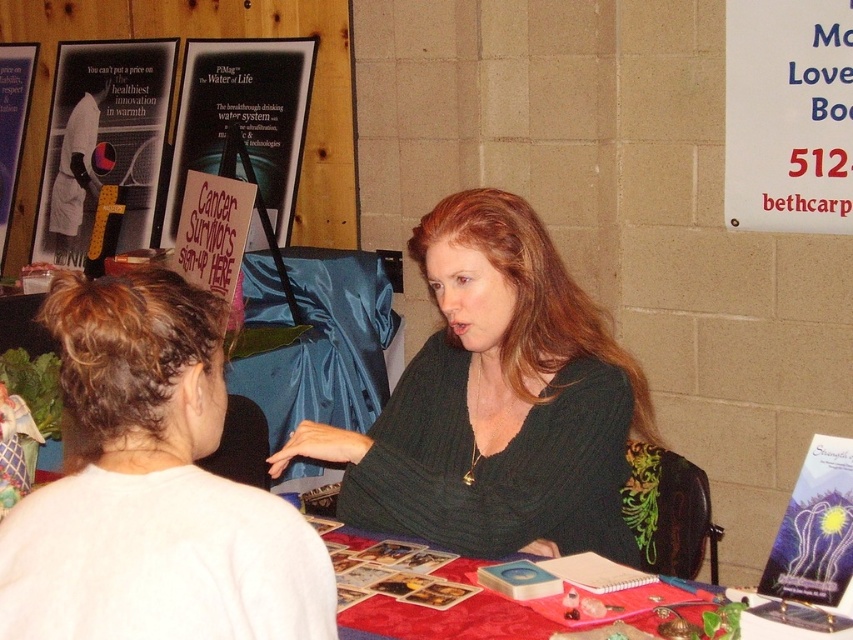
Question: Among these objects, which one is nearest to the camera?

Choices:
 (A) green knitted sweater at center
 (B) white paper sign at upper left

Answer: (A)

Question: Does white paper sign at upper right have a smaller size compared to matte black tennis racket at upper left?

Choices:
 (A) no
 (B) yes

Answer: (B)

Question: Does white paper sign at upper left have a smaller size compared to matte black tennis racket at upper left?

Choices:
 (A) yes
 (B) no

Answer: (B)

Question: Which point appears farthest from the camera in this image?

Choices:
 (A) (537, 244)
 (B) (827, 452)
 (C) (730, 161)
 (D) (49, 244)

Answer: (D)

Question: Where is green knitted sweater at center located in relation to metallic silver poster at lower right in the image?

Choices:
 (A) below
 (B) above

Answer: (B)

Question: Among these objects, which one is farthest from the camera?

Choices:
 (A) red fabric table at center
 (B) white paper sign at upper right
 (C) metallic silver poster at lower right
 (D) green knitted sweater at center

Answer: (B)